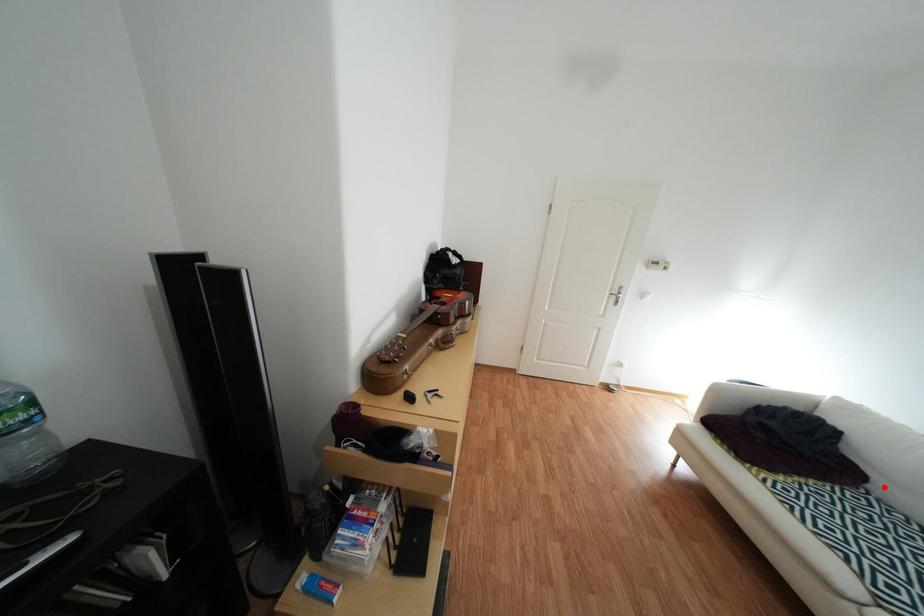
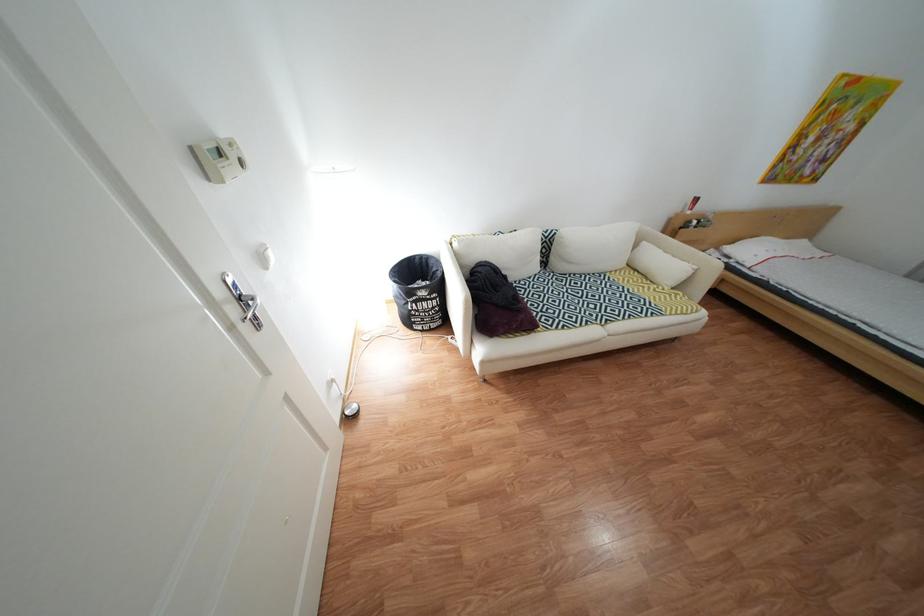
Question: I am providing you with two images of the same scene from different viewpoints. In image1, a red point is highlighted. Considering the same 3D point in image2, which of the following is correct?

Choices:
 (A) It is closer
 (B) It is farther

Answer: (B)